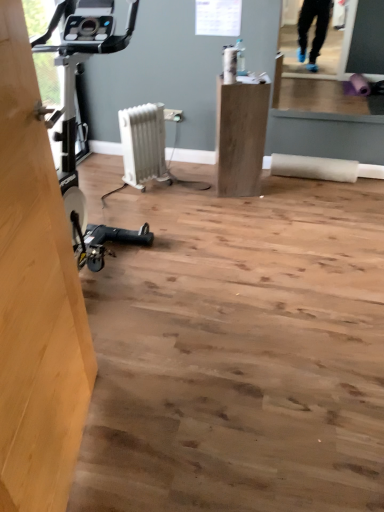
This screenshot has height=512, width=384. I want to click on vacant space behind light brown wood at left, so click(139, 358).